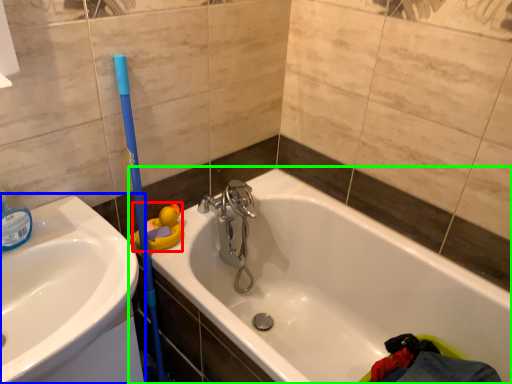
Question: Estimate the real-world distances between objects in this image. Which object is farther from toy (highlighted by a red box), sink (highlighted by a blue box) or bathtub (highlighted by a green box)?

Choices:
 (A) sink
 (B) bathtub

Answer: (B)